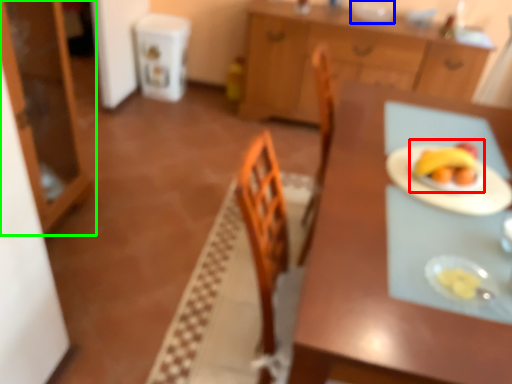
Question: Considering the real-world distances, which object is farthest from fruit dish (highlighted by a red box)? tableware (highlighted by a blue box) or cabinetry (highlighted by a green box)?

Choices:
 (A) tableware
 (B) cabinetry

Answer: (A)